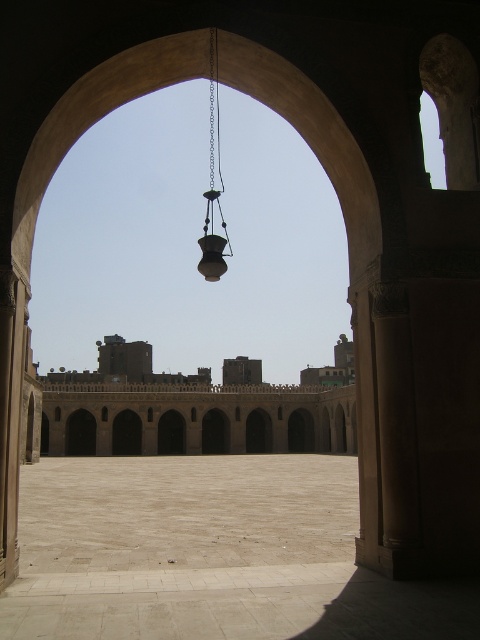
Question: Which point is farther from the camera taking this photo?

Choices:
 (A) (212, 172)
 (B) (248, 372)

Answer: (A)

Question: Does beige stone palace at center have a lesser width compared to metallic chain at center?

Choices:
 (A) no
 (B) yes

Answer: (A)

Question: Which of the following is the farthest from the observer?

Choices:
 (A) (215, 280)
 (B) (108, 420)

Answer: (B)

Question: Is beige stone palace at center to the right of metallic chain at center from the viewer's perspective?

Choices:
 (A) yes
 (B) no

Answer: (B)

Question: In this image, where is beige stone palace at center located relative to metallic chain at center?

Choices:
 (A) above
 (B) below

Answer: (B)

Question: Which of the following is the closest to the observer?

Choices:
 (A) (202, 253)
 (B) (252, 388)

Answer: (A)